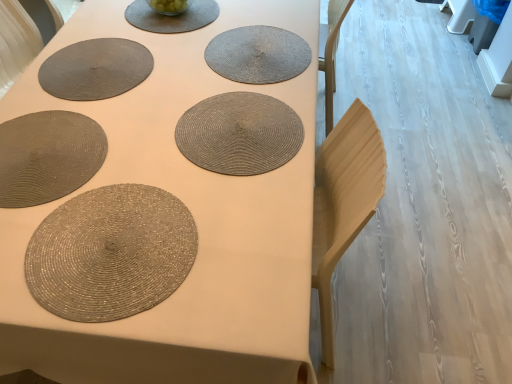
Where is `free space that is in between rattan placemat at center, which is the 2th coaster in top-to-bottom order, and matte gray placemat at upper left, placed as the first paper plate when sorted from back to front`? free space that is in between rattan placemat at center, which is the 2th coaster in top-to-bottom order, and matte gray placemat at upper left, placed as the first paper plate when sorted from back to front is located at coordinates (156, 92).